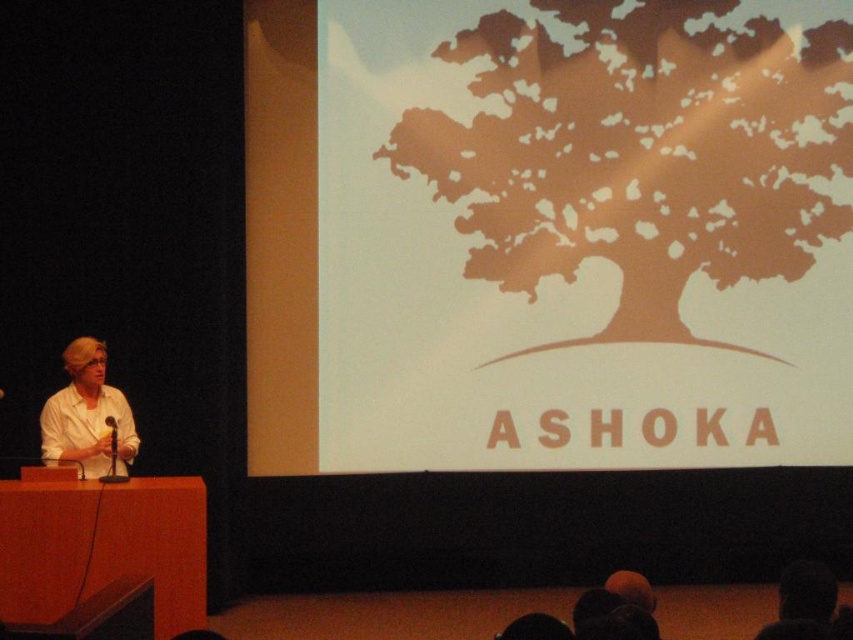
From the picture: Does brown paper tree at upper center have a larger size compared to white matte shirt at left?

Yes.

Between point (637, 294) and point (85, 476), which one is positioned in front?

Point (85, 476)

Does point (798, 202) come closer to viewer compared to point (91, 472)?

That is False.

The height and width of the screenshot is (640, 853). I want to click on brown paper tree at upper center, so click(x=640, y=152).

Is white matte shirt at left positioned before black matte microphone at left?

No, white matte shirt at left is further to the viewer.

Which is above, white matte shirt at left or black matte microphone at left?

white matte shirt at left

Is point (68, 394) farther from viewer compared to point (115, 449)?

Yes, point (68, 394) is farther from viewer.

Identify the location of white matte shirt at left. The image size is (853, 640). (88, 417).

Who is more distant from viewer, (614, 54) or (115, 428)?

The point (614, 54) is more distant.

Who is higher up, brown paper tree at upper center or black matte microphone at left?

brown paper tree at upper center is above.

Who is more forward, (664, 156) or (109, 472)?

Point (109, 472) is more forward.

Locate an element on the screen. brown paper tree at upper center is located at coordinates (640, 152).